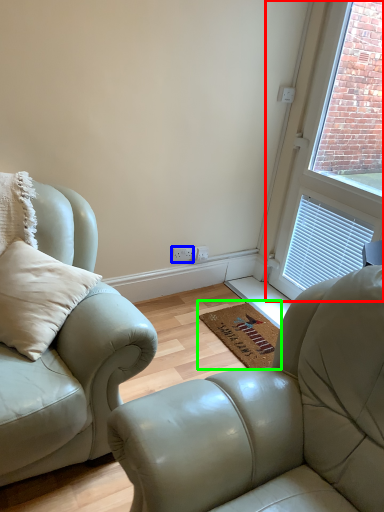
Question: Based on their relative distances, which object is farther from window (highlighted by a red box)? Choose from electric outlet (highlighted by a blue box) and doormat (highlighted by a green box).

Choices:
 (A) electric outlet
 (B) doormat

Answer: (A)